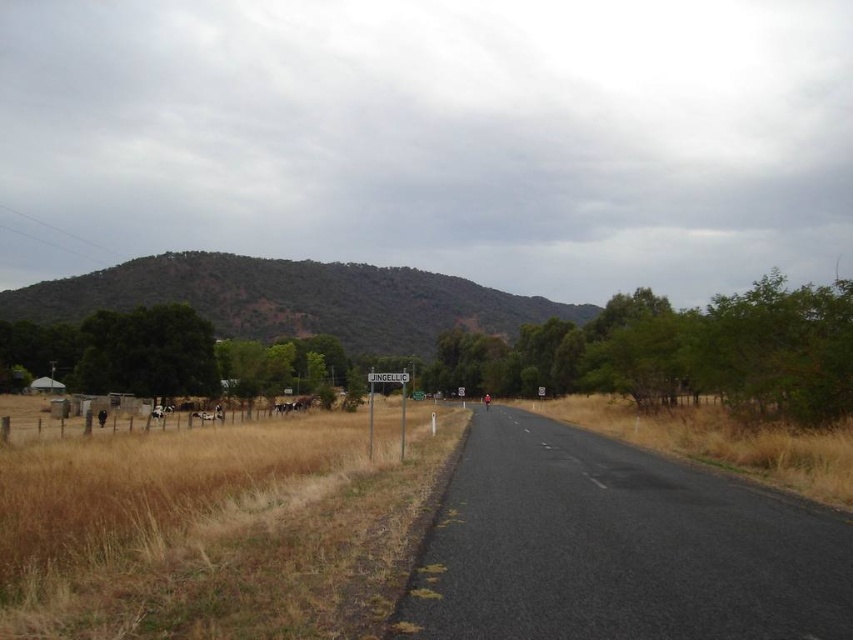
You are a delivery driver approaching the road with a truck that is 6 meters long. You see the brown fur horse at lower left and the brown fur animal at left on the left side of the road. Can your truck pass between them without getting too close?

The distance between the brown fur horse at lower left and the brown fur animal at left is 7.73 meters. Since your truck is 6 meters long, there is enough space for the truck to pass between them safely.

You are standing at the starting point of the road and want to reach the green textured hill at center. Which direction should you walk to get there?

The green textured hill at center is located at the 2D coordinates point (x=293, y=300), so you should walk forward along the road as it curves to the right towards the hill.

You are driving on the road and notice dry grass at left and dry grass at road center. Which dry grass area is closer to your current position?

The dry grass at left is closer to your current position because it is positioned over the dry grass at road center, indicating it is in front of it from the driver perspective.